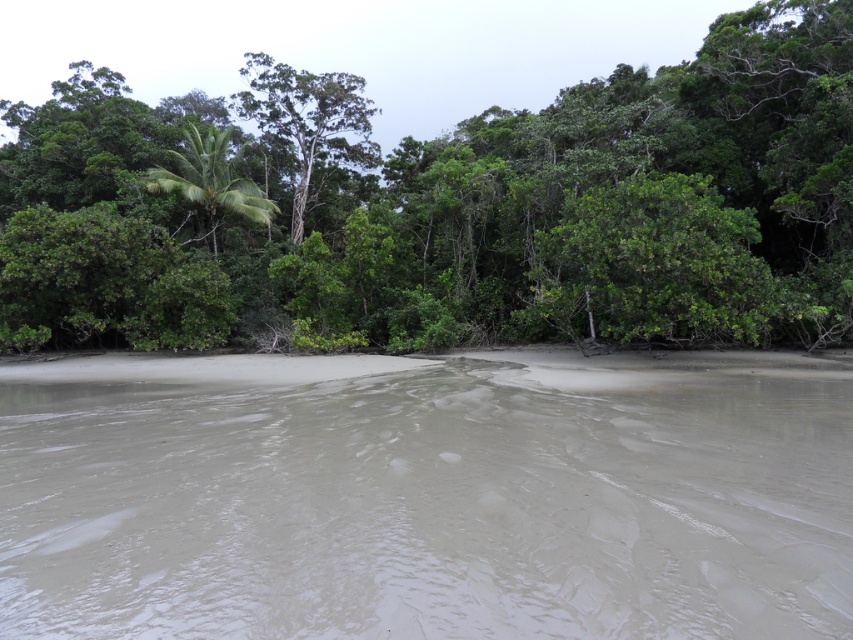
Does point (112, 317) come closer to viewer compared to point (236, 196)?

Yes, it is.

Does green leafy tree at center appear under green leafy palm at upper left?

Actually, green leafy tree at center is above green leafy palm at upper left.

Does point (41, 225) lie behind point (192, 166)?

No.

At what (x,y) coordinates should I click in order to perform the action: click on green leafy tree at center. Please return your answer as a coordinate pair (x, y). The image size is (853, 640). Looking at the image, I should click on (447, 205).

Can you confirm if green leafy tree at center is positioned to the right of green leafy tree at upper center?

Incorrect, green leafy tree at center is not on the right side of green leafy tree at upper center.

Does green leafy tree at center come behind green leafy tree at upper center?

No, it is in front of green leafy tree at upper center.

Which is behind, point (59, 184) or point (294, 218)?

The point (294, 218) is behind.

In order to click on green leafy tree at center in this screenshot , I will do `click(447, 205)`.

Which is more to the left, gray mud at center or green leafy tree at upper center?

From the viewer's perspective, green leafy tree at upper center appears more on the left side.

Between gray mud at center and green leafy tree at upper center, which one has less height?

gray mud at center

Between point (142, 561) and point (285, 125), which one is positioned in front?

Positioned in front is point (142, 561).

What are the coordinates of `gray mud at center` in the screenshot? It's located at (427, 496).